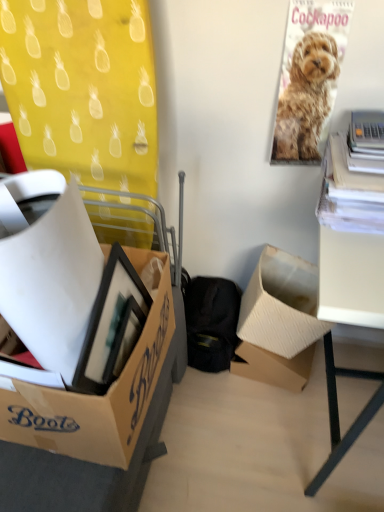
Question: Can you confirm if cardboard box at center, arranged as the third box when viewed from the front, is positioned to the right of white matte desk at right?

Choices:
 (A) no
 (B) yes

Answer: (A)

Question: Is cardboard box at center, arranged as the third box when viewed from the front, taller than white matte desk at right?

Choices:
 (A) no
 (B) yes

Answer: (A)

Question: Is cardboard box at center, arranged as the third box when viewed from the front, positioned beyond the bounds of white matte desk at right?

Choices:
 (A) no
 (B) yes

Answer: (A)

Question: Does cardboard box at center, marked as the 2th box in a back-to-front arrangement, come in front of white matte desk at right?

Choices:
 (A) yes
 (B) no

Answer: (B)

Question: Considering the relative sizes of cardboard box at center, marked as the 2th box in a back-to-front arrangement, and white matte desk at right in the image provided, is cardboard box at center, marked as the 2th box in a back-to-front arrangement, wider than white matte desk at right?

Choices:
 (A) yes
 (B) no

Answer: (B)

Question: Is cardboard box at center, arranged as the third box when viewed from the front, situated inside cardboard box at center, which is the fourth box in front-to-back order, or outside?

Choices:
 (A) outside
 (B) inside

Answer: (A)

Question: Relative to cardboard box at center, which is the fourth box in front-to-back order, is cardboard box at center, arranged as the third box when viewed from the front, in front or behind?

Choices:
 (A) behind
 (B) front

Answer: (B)

Question: Visually, is cardboard box at center, arranged as the third box when viewed from the front, positioned to the left or to the right of cardboard box at center, arranged as the 1th box when viewed from the back?

Choices:
 (A) right
 (B) left

Answer: (A)

Question: Does point tap(248, 328) appear closer or farther from the camera than point tap(259, 366)?

Choices:
 (A) farther
 (B) closer

Answer: (B)

Question: Based on their positions, is golden fur poster at upper right located to the left or right of cardboard box at center, marked as the 2th box in a back-to-front arrangement?

Choices:
 (A) left
 (B) right

Answer: (A)

Question: Would you say golden fur poster at upper right is inside or outside cardboard box at center, arranged as the third box when viewed from the front?

Choices:
 (A) inside
 (B) outside

Answer: (B)

Question: Considering the positions of golden fur poster at upper right and cardboard box at center, marked as the 2th box in a back-to-front arrangement, in the image, is golden fur poster at upper right taller or shorter than cardboard box at center, marked as the 2th box in a back-to-front arrangement,?

Choices:
 (A) tall
 (B) short

Answer: (A)

Question: Relative to cardboard box at center, marked as the 2th box in a back-to-front arrangement, is golden fur poster at upper right in front or behind?

Choices:
 (A) behind
 (B) front

Answer: (B)

Question: From a real-world perspective, is cardboard box at left, which is counted as the third box, starting from the back, physically located above or below cardboard box at center, arranged as the third box when viewed from the front?

Choices:
 (A) above
 (B) below

Answer: (A)

Question: Which is correct: cardboard box at left, which is counted as the third box, starting from the back, is inside cardboard box at center, arranged as the third box when viewed from the front, or outside of it?

Choices:
 (A) inside
 (B) outside

Answer: (B)